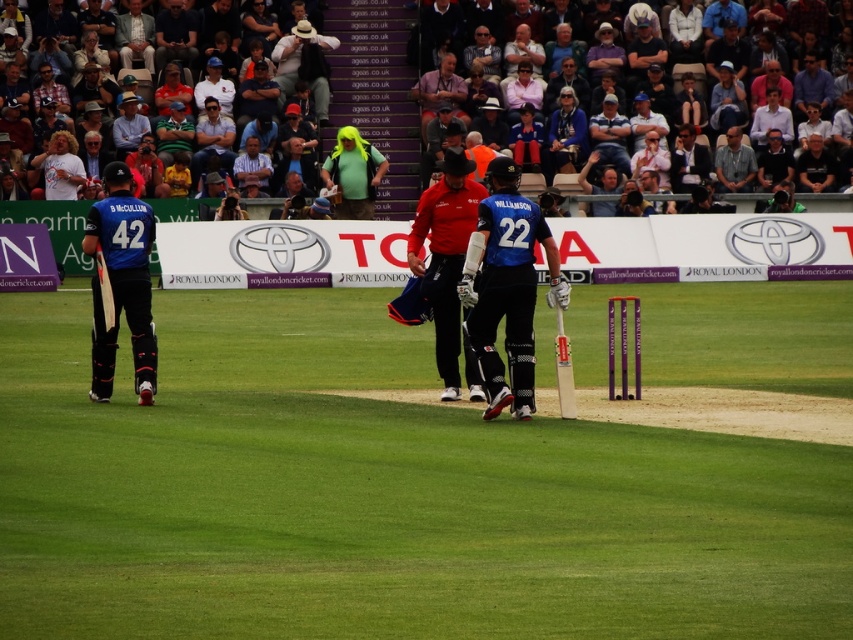
You are a player in the cricket match and need to retrieve your bat from the center of the field. Where exactly should you look for the red matte bat at center?

The red matte bat at center is located at point coordinates (445, 253).